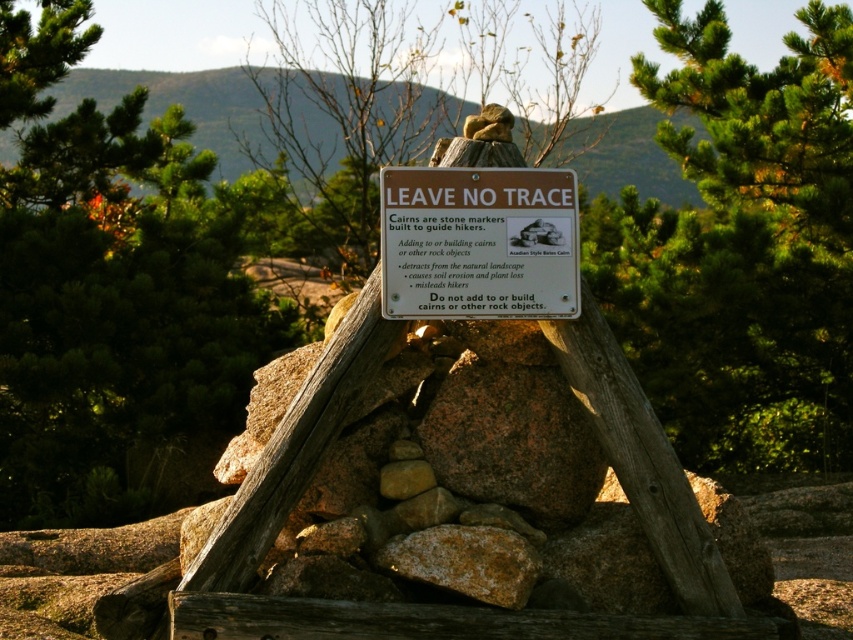
You are a hiker who wants to take a photo of the brown paper sign at center. You notice a green leafy tree at upper right in the background. Will the tree block the sign in your photo?

The green leafy tree at upper right is much taller than the brown paper sign at center, so the tree might block part of the sign in your photo depending on your angle and distance.

You are a hiker who wants to read the brown paper sign at center but notices the green leafy tree at upper right is blocking your view. Can you move around to see the entire sign clearly?

The brown paper sign at center is behind the green leafy tree at upper right, so moving to a position where the tree is no longer between you and the sign would allow you to see the entire sign clearly.